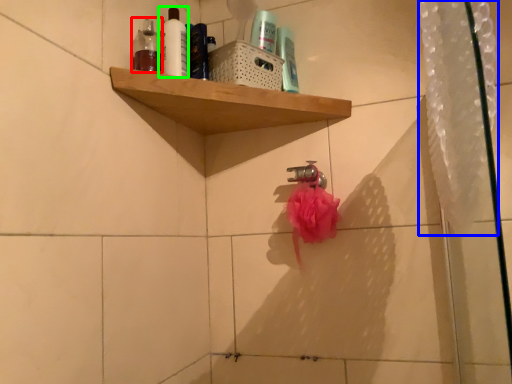
Question: Based on their relative distances, which object is nearer to toiletry (highlighted by a red box)? Choose from shower curtain (highlighted by a blue box) and mouthwash (highlighted by a green box).

Choices:
 (A) shower curtain
 (B) mouthwash

Answer: (B)